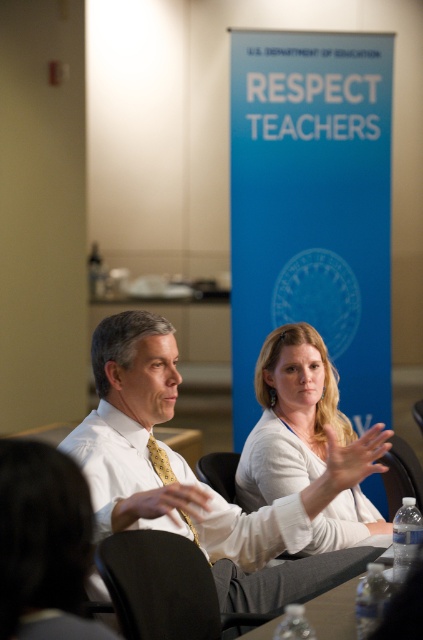
Question: Which is farther from the white shirt at center?

Choices:
 (A) white matte shirt at center
 (B) yellowtexturetie at center
 (C) clear plastic water bottles at lower center

Answer: (C)

Question: Which of the following is the farthest from the observer?

Choices:
 (A) (365, 440)
 (B) (414, 588)
 (C) (189, 529)

Answer: (C)

Question: Is white matte shirt at center further to camera compared to clear plastic water bottles at lower center?

Choices:
 (A) yes
 (B) no

Answer: (A)

Question: In this image, where is clear plastic water bottles at lower center located relative to yellowtexturetie at center?

Choices:
 (A) right
 (B) left

Answer: (A)

Question: From the image, what is the correct spatial relationship of white matte shirt at center in relation to yellowtexturetie at center?

Choices:
 (A) right
 (B) left

Answer: (A)

Question: Considering the real-world distances, which object is closest to the clear plastic water bottles at lower center?

Choices:
 (A) yellowtexturetie at center
 (B) white shirt at center

Answer: (B)